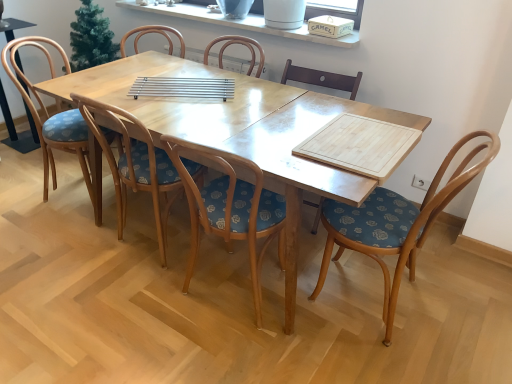
Measure the distance between point (33, 108) and camera.

Point (33, 108) and camera are 2.21 meters apart.

You are a GUI agent. You are given a task and a screenshot of the screen. Output one action in this format:
    pyautogui.click(x=<x>, y=<y>)
    Task: Click on the wooden chair with floral cushion at center, which is the 5th chair in right-to-left order
    The height and width of the screenshot is (384, 512).
    Given the screenshot: What is the action you would take?
    pyautogui.click(x=48, y=114)

The width and height of the screenshot is (512, 384). Find the location of `white ceramic window sill at upper center`. white ceramic window sill at upper center is located at coordinates (242, 23).

Find the location of a particular element. This screenshot has width=512, height=384. wooden chair with floral upholstery at center, the 3th chair in the left-to-right sequence is located at coordinates (229, 208).

Where is `woodenwoodenchair at right, the 1th chair in the right-to-left sequence`? This screenshot has height=384, width=512. woodenwoodenchair at right, the 1th chair in the right-to-left sequence is located at coordinates (396, 223).

In order to face light wood table at center, should I rotate leftwards or rightwards?

Rotate your view left by about 4.366°.

What do you see at coordinates (242, 131) in the screenshot?
I see `light wood table at center` at bounding box center [242, 131].

Find the location of a particular element. wooden at center, the 4th chair when ordered from left to right is located at coordinates (322, 78).

Does wooden chair with floral upholstery at center, the fourth chair when ordered from right to left, have a greater width compared to wooden chair with floral upholstery at center, the 3th chair in the left-to-right sequence?

Yes, wooden chair with floral upholstery at center, the fourth chair when ordered from right to left, is wider than wooden chair with floral upholstery at center, the 3th chair in the left-to-right sequence.

Visually, is wooden chair with floral upholstery at center, the fourth chair when ordered from right to left, positioned to the left or to the right of wooden chair with floral upholstery at center, marked as the third chair in a right-to-left arrangement?

wooden chair with floral upholstery at center, the fourth chair when ordered from right to left, is to the left of wooden chair with floral upholstery at center, marked as the third chair in a right-to-left arrangement.

From a real-world perspective, is wooden chair with floral upholstery at center, positioned as the second chair in left-to-right order, positioned over wooden chair with floral upholstery at center, the 3th chair in the left-to-right sequence, based on gravity?

Yes, from a real-world perspective, wooden chair with floral upholstery at center, positioned as the second chair in left-to-right order, is on top of wooden chair with floral upholstery at center, the 3th chair in the left-to-right sequence.

From the image's perspective, is wooden chair at left located above or below wooden chair with floral cushion at center, the first chair from the left?

Based on their image positions, wooden chair at left is located above wooden chair with floral cushion at center, the first chair from the left.

Can wooden chair with floral cushion at center, the first chair from the left, be found inside wooden chair at left?

No, wooden chair at left does not contain wooden chair with floral cushion at center, the first chair from the left.

Are wooden chair at left and wooden chair with floral cushion at center, the first chair from the left, beside each other?

Yes, wooden chair at left is with wooden chair with floral cushion at center, the first chair from the left.

Is wooden chair at left bigger or smaller than wooden chair with floral cushion at center, which is the 5th chair in right-to-left order?

In the image, wooden chair at left appears to be smaller than wooden chair with floral cushion at center, which is the 5th chair in right-to-left order.

Is white ceramic window sill at upper center facing towards wooden chair with floral upholstery at center, the fourth chair when ordered from right to left?

No, white ceramic window sill at upper center does not turn towards wooden chair with floral upholstery at center, the fourth chair when ordered from right to left.

Which is correct: white ceramic window sill at upper center is inside wooden chair with floral upholstery at center, positioned as the second chair in left-to-right order, or outside of it?

white ceramic window sill at upper center is not enclosed by wooden chair with floral upholstery at center, positioned as the second chair in left-to-right order.

Could you measure the distance between white ceramic window sill at upper center and wooden chair with floral upholstery at center, the fourth chair when ordered from right to left?

white ceramic window sill at upper center is 3.80 feet away from wooden chair with floral upholstery at center, the fourth chair when ordered from right to left.

Considering the sizes of white ceramic window sill at upper center and wooden chair with floral upholstery at center, positioned as the second chair in left-to-right order, in the image, is white ceramic window sill at upper center wider or thinner than wooden chair with floral upholstery at center, positioned as the second chair in left-to-right order,?

Clearly, white ceramic window sill at upper center has less width compared to wooden chair with floral upholstery at center, positioned as the second chair in left-to-right order.

Considering the points (253, 197) and (392, 228), which point is in front, point (253, 197) or point (392, 228)?

Positioned in front is point (392, 228).

Is wooden chair with floral upholstery at center, marked as the third chair in a right-to-left arrangement, behind woodenwoodenchair at right, which is counted as the fifth chair, starting from the left?

No, the depth of wooden chair with floral upholstery at center, marked as the third chair in a right-to-left arrangement, is less than that of woodenwoodenchair at right, which is counted as the fifth chair, starting from the left.

Is wooden chair with floral upholstery at center, the 3th chair in the left-to-right sequence, thinner than woodenwoodenchair at right, the 1th chair in the right-to-left sequence?

Correct, the width of wooden chair with floral upholstery at center, the 3th chair in the left-to-right sequence, is less than that of woodenwoodenchair at right, the 1th chair in the right-to-left sequence.

In terms of height, does wooden chair with floral upholstery at center, the 3th chair in the left-to-right sequence, look taller or shorter compared to woodenwoodenchair at right, the 1th chair in the right-to-left sequence?

Clearly, wooden chair with floral upholstery at center, the 3th chair in the left-to-right sequence, is taller compared to woodenwoodenchair at right, the 1th chair in the right-to-left sequence.

From the image's perspective, is wooden chair with floral upholstery at center, the fourth chair when ordered from right to left, above or below wooden at center, the 4th chair when ordered from left to right?

From the image's perspective, wooden chair with floral upholstery at center, the fourth chair when ordered from right to left, appears below wooden at center, the 4th chair when ordered from left to right.

How many degrees apart are the facing directions of wooden chair with floral upholstery at center, positioned as the second chair in left-to-right order, and wooden at center, the second chair when ordered from right to left?

They differ by 175 degrees in their facing directions.

Is point (153, 147) closer or farther from the camera than point (315, 77)?

Point (153, 147).

Which is in front, wooden chair with floral upholstery at center, positioned as the second chair in left-to-right order, or wooden at center, the second chair when ordered from right to left?

Positioned in front is wooden chair with floral upholstery at center, positioned as the second chair in left-to-right order.

From their relative heights in the image, would you say white ceramic window sill at upper center is taller or shorter than light wood table at center?

Clearly, white ceramic window sill at upper center is shorter compared to light wood table at center.

From the picture: Is white ceramic window sill at upper center placed right next to light wood table at center?

No, white ceramic window sill at upper center is not touching light wood table at center.

Can we say white ceramic window sill at upper center lies outside light wood table at center?

Absolutely, white ceramic window sill at upper center is external to light wood table at center.

Who is smaller, white ceramic window sill at upper center or light wood table at center?

white ceramic window sill at upper center.

Looking at the image, does wooden chair with floral upholstery at center, the 3th chair in the left-to-right sequence, seem bigger or smaller compared to wooden chair with floral upholstery at center, positioned as the second chair in left-to-right order?

In the image, wooden chair with floral upholstery at center, the 3th chair in the left-to-right sequence, appears to be larger than wooden chair with floral upholstery at center, positioned as the second chair in left-to-right order.

Are wooden chair with floral upholstery at center, marked as the third chair in a right-to-left arrangement, and wooden chair with floral upholstery at center, the fourth chair when ordered from right to left, far apart?

No.

From the image's perspective, does wooden chair with floral upholstery at center, marked as the third chair in a right-to-left arrangement, appear higher than wooden chair with floral upholstery at center, the fourth chair when ordered from right to left?

Incorrect, from the image's perspective, wooden chair with floral upholstery at center, marked as the third chair in a right-to-left arrangement, is lower than wooden chair with floral upholstery at center, the fourth chair when ordered from right to left.

Considering the relative sizes of wooden chair with floral upholstery at center, the 3th chair in the left-to-right sequence, and wooden chair with floral upholstery at center, positioned as the second chair in left-to-right order, in the image provided, is wooden chair with floral upholstery at center, the 3th chair in the left-to-right sequence, wider than wooden chair with floral upholstery at center, positioned as the second chair in left-to-right order,?

No.

I want to click on the 2nd chair in front of the wooden chair with floral upholstery at center, the fourth chair when ordered from right to left, so click(229, 208).

The width and height of the screenshot is (512, 384). Find the location of `armchair lying behind the wooden chair with floral cushion at center, which is the 5th chair in right-to-left order`. armchair lying behind the wooden chair with floral cushion at center, which is the 5th chair in right-to-left order is located at coordinates (22, 70).

Looking at the image, which one is located closer to wooden chair at left, wooden chair with floral cushion at center, the first chair from the left, or woodenwoodenchair at right, the 1th chair in the right-to-left sequence?

Among the two, wooden chair with floral cushion at center, the first chair from the left, is located nearer to wooden chair at left.

Based on their spatial positions, is wooden chair with floral cushion at center, which is the 5th chair in right-to-left order, or light wood table at center further from wooden chair at left?

The object further to wooden chair at left is light wood table at center.

Looking at the image, which one is located further to light wood table at center, wooden chair with floral upholstery at center, the 3th chair in the left-to-right sequence, or wooden at center, the 4th chair when ordered from left to right?

wooden at center, the 4th chair when ordered from left to right, is further to light wood table at center.

Considering their positions, is wooden at center, the second chair when ordered from right to left, positioned closer to light wood table at center than wooden chair with floral upholstery at center, marked as the third chair in a right-to-left arrangement?

Based on the image, wooden chair with floral upholstery at center, marked as the third chair in a right-to-left arrangement, appears to be nearer to light wood table at center.

In the scene shown: When comparing their distances from woodenwoodenchair at right, which is counted as the fifth chair, starting from the left, does white ceramic window sill at upper center or wooden chair with floral upholstery at center, positioned as the second chair in left-to-right order, seem closer?

Among the two, wooden chair with floral upholstery at center, positioned as the second chair in left-to-right order, is located nearer to woodenwoodenchair at right, which is counted as the fifth chair, starting from the left.

From the image, which object appears to be nearer to wooden chair at left, wooden chair with floral cushion at center, which is the 5th chair in right-to-left order, or wooden chair with floral upholstery at center, the 3th chair in the left-to-right sequence?

The object closer to wooden chair at left is wooden chair with floral cushion at center, which is the 5th chair in right-to-left order.

Which object lies nearer to the anchor point wooden chair at left, woodenwoodenchair at right, which is counted as the fifth chair, starting from the left, or white ceramic window sill at upper center?

Among the two, white ceramic window sill at upper center is located nearer to wooden chair at left.

From the image, which object appears to be farther from woodenwoodenchair at right, the 1th chair in the right-to-left sequence, wooden chair with floral upholstery at center, positioned as the second chair in left-to-right order, or wooden at center, the 4th chair when ordered from left to right?

wooden at center, the 4th chair when ordered from left to right, lies further to woodenwoodenchair at right, the 1th chair in the right-to-left sequence, than the other object.

I want to click on kitchen & dining room table between wooden chair with floral upholstery at center, positioned as the second chair in left-to-right order, and woodenwoodenchair at right, the 1th chair in the right-to-left sequence, in the horizontal direction, so click(x=242, y=131).

Where is `chair located between wooden chair with floral cushion at center, which is the 5th chair in right-to-left order, and light wood table at center in the left-right direction`? chair located between wooden chair with floral cushion at center, which is the 5th chair in right-to-left order, and light wood table at center in the left-right direction is located at coordinates (134, 164).

Identify the location of kitchen & dining room table located between wooden chair at left and wooden at center, the second chair when ordered from right to left, in the left-right direction. This screenshot has width=512, height=384. (242, 131).

Identify the location of chair located between wooden chair with floral cushion at center, the first chair from the left, and wooden chair with floral upholstery at center, marked as the third chair in a right-to-left arrangement, in the left-right direction. The width and height of the screenshot is (512, 384). (134, 164).